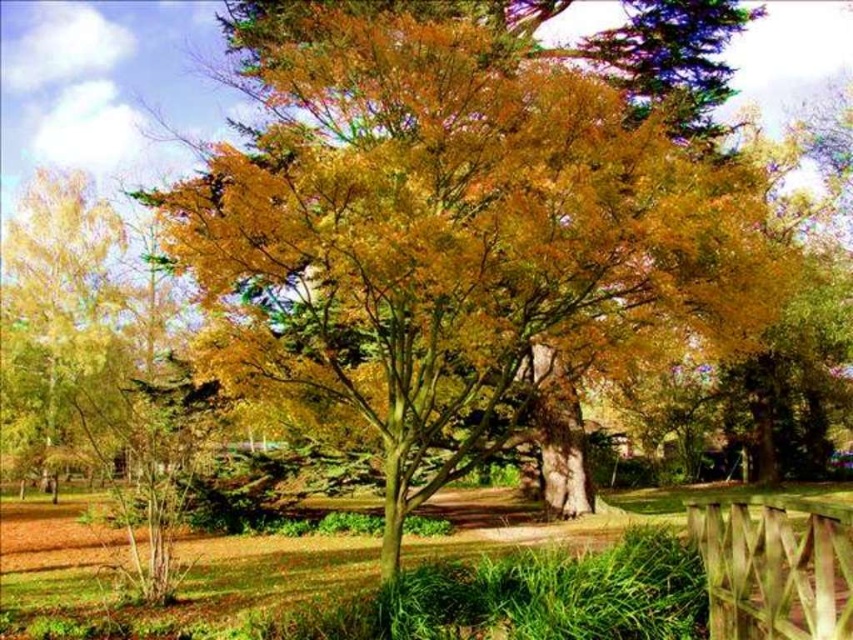
Question: Which point is farther from the camera taking this photo?

Choices:
 (A) (805, 564)
 (B) (67, 204)

Answer: (B)

Question: Can you confirm if golden yellow leaves at center is wider than golden yellow leaves at left?

Choices:
 (A) no
 (B) yes

Answer: (B)

Question: Does golden yellow leaves at center appear on the left side of wooden fence at lower right?

Choices:
 (A) yes
 (B) no

Answer: (A)

Question: Which is nearer to the wooden fence at lower right?

Choices:
 (A) golden yellow leaves at left
 (B) golden yellow leaves at center

Answer: (B)

Question: Which object appears closest to the camera in this image?

Choices:
 (A) wooden fence at lower right
 (B) golden yellow leaves at center

Answer: (A)

Question: Is golden yellow leaves at center to the left of wooden fence at lower right from the viewer's perspective?

Choices:
 (A) no
 (B) yes

Answer: (B)